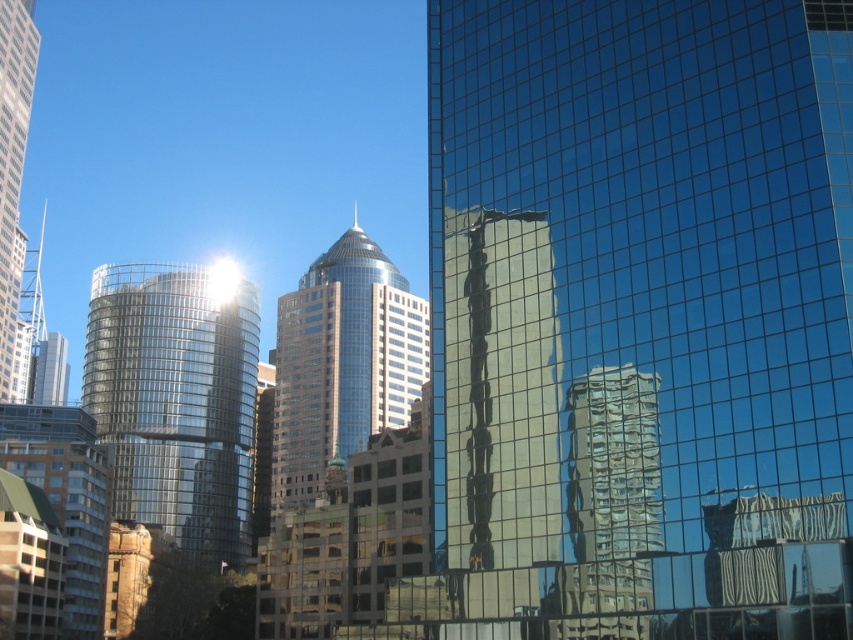
Question: Which point is closer to the camera?

Choices:
 (A) (4, 154)
 (B) (476, 552)

Answer: (B)

Question: Which point is closer to the camera?

Choices:
 (A) (4, 122)
 (B) (380, 305)
 (C) (555, 276)

Answer: (C)

Question: Does reflective glass skyscraper at center appear under matte glass skyscraper at left?

Choices:
 (A) yes
 (B) no

Answer: (A)

Question: Can you confirm if transparent glass skyscraper at center is bigger than shiny glass skyscraper at center?

Choices:
 (A) yes
 (B) no

Answer: (B)

Question: Which is farther from the matte glass skyscraper at left?

Choices:
 (A) reflective glass skyscraper at center
 (B) shiny glass skyscraper at center
 (C) shiny glass tower at center
 (D) reflective glass building at center

Answer: (D)

Question: Is reflective glass skyscraper at center smaller than shiny glass skyscraper at center?

Choices:
 (A) yes
 (B) no

Answer: (A)